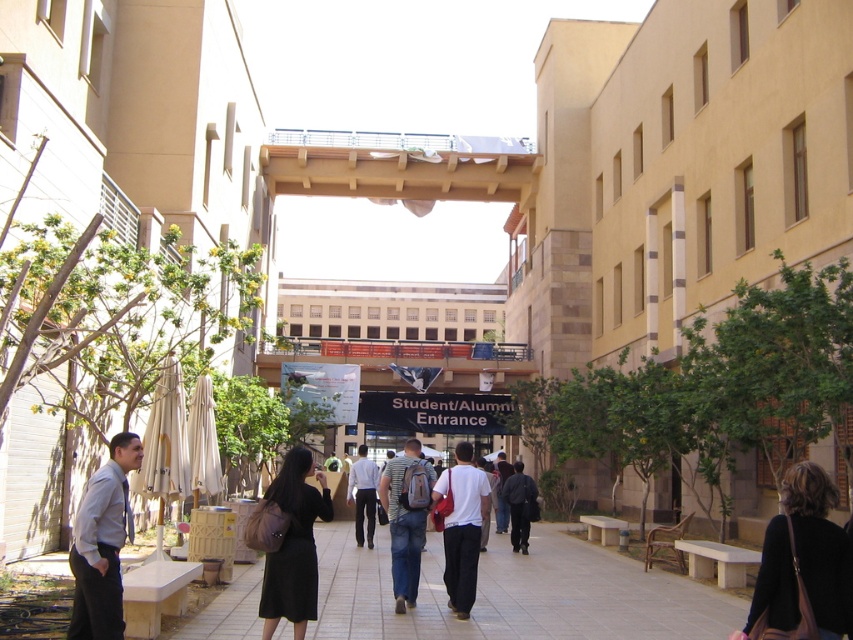
You are standing in the courtyard of a university campus and see a striped cotton shirt at center. Where exactly is the striped cotton shirt located in the courtyard?

The striped cotton shirt at center is located at point (405, 518) in the courtyard.

You are a visitor at the university campus and see two people wearing shirts in the courtyard. One is wearing a striped cotton shirt at center and the other a white smooth shirt at center. Which shirt is located to the right when viewed from the front?

A: The striped cotton shirt at center is positioned on the right side of the white smooth shirt at center, so when viewed from the front, the striped cotton shirt at center is to the right of the white smooth shirt at center.